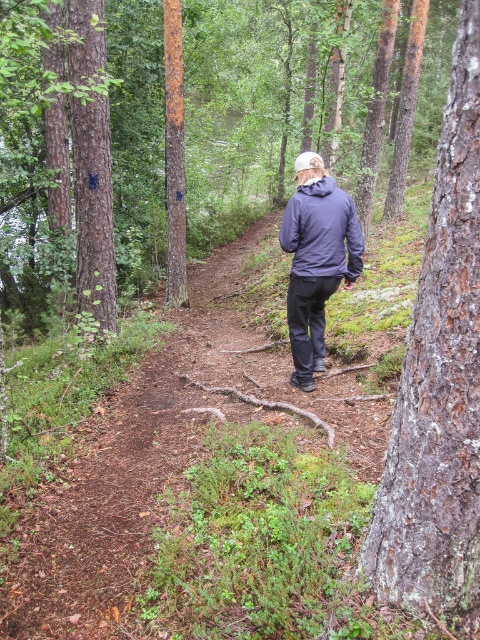
Can you confirm if dark blue jacket at center is positioned above rusty metal tree at center?

Incorrect, dark blue jacket at center is not positioned above rusty metal tree at center.

Does dark blue jacket at center appear under rusty metal tree at center?

Correct, dark blue jacket at center is located below rusty metal tree at center.

Is point (300, 196) positioned in front of point (181, 202)?

Yes, point (300, 196) is closer to viewer.

Where is `dark blue jacket at center`? The height and width of the screenshot is (640, 480). dark blue jacket at center is located at coordinates (315, 259).

Measure the distance between smooth bark tree at right and camera.

smooth bark tree at right and camera are 6.39 feet apart from each other.

Between smooth bark tree at right and dark blue jacket at center, which one appears on the left side from the viewer's perspective?

From the viewer's perspective, dark blue jacket at center appears more on the left side.

Who is more distant from viewer, [400,589] or [296,172]?

Positioned behind is point [296,172].

Identify the location of smooth bark tree at right. (439, 381).

Looking at this image, is smooth brown tree trunk at left thinner than rusty metal tree at center?

Incorrect, smooth brown tree trunk at left's width is not less than rusty metal tree at center's.

Which is behind, point (85, 60) or point (179, 115)?

Point (179, 115)

Which is in front, point (108, 182) or point (178, 84)?

Positioned in front is point (108, 182).

Identify the location of smooth brown tree trunk at left. The image size is (480, 640). (92, 163).